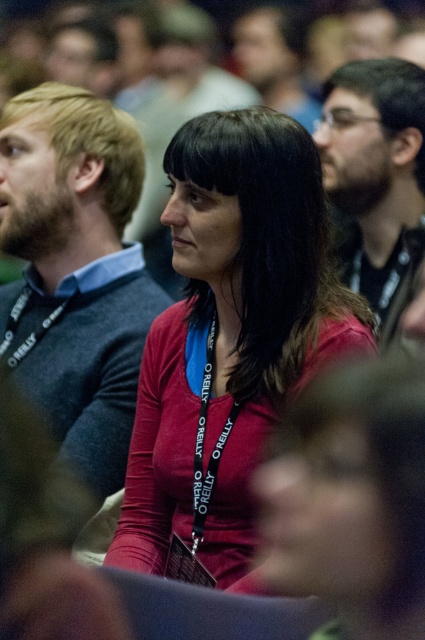
Question: Which is nearer to the matte gray sweater at left?

Choices:
 (A) matte black glasses at upper right
 (B) matte red shirt at center

Answer: (B)

Question: Is matte red shirt at center above matte black glasses at upper right?

Choices:
 (A) no
 (B) yes

Answer: (A)

Question: Which point appears farthest from the camera in this image?

Choices:
 (A) (116, 269)
 (B) (320, 356)

Answer: (A)

Question: Does matte red shirt at center appear over matte black glasses at upper right?

Choices:
 (A) no
 (B) yes

Answer: (A)

Question: Can you confirm if matte gray sweater at left is bigger than matte black glasses at upper right?

Choices:
 (A) no
 (B) yes

Answer: (B)

Question: Among these objects, which one is farthest from the camera?

Choices:
 (A) matte red shirt at center
 (B) matte black glasses at upper right

Answer: (B)